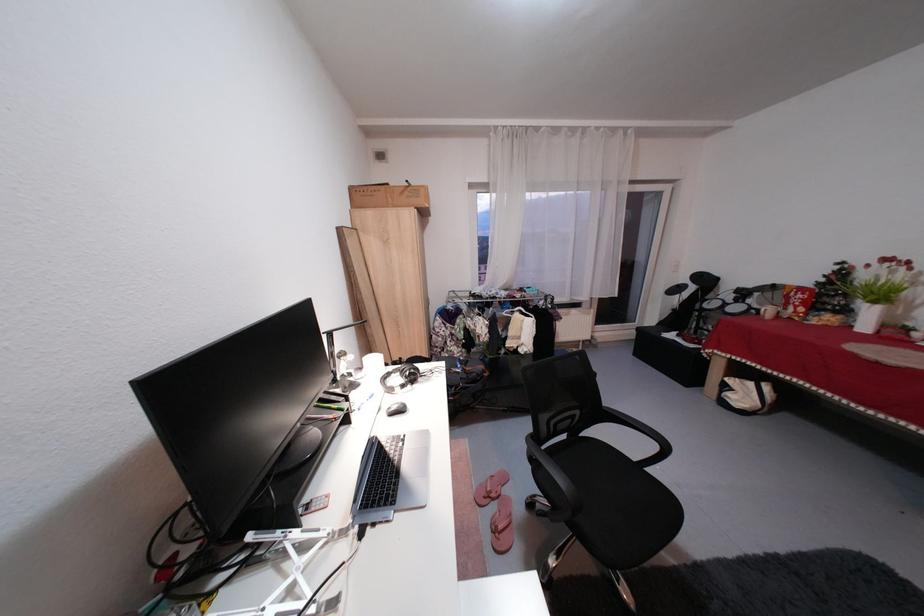
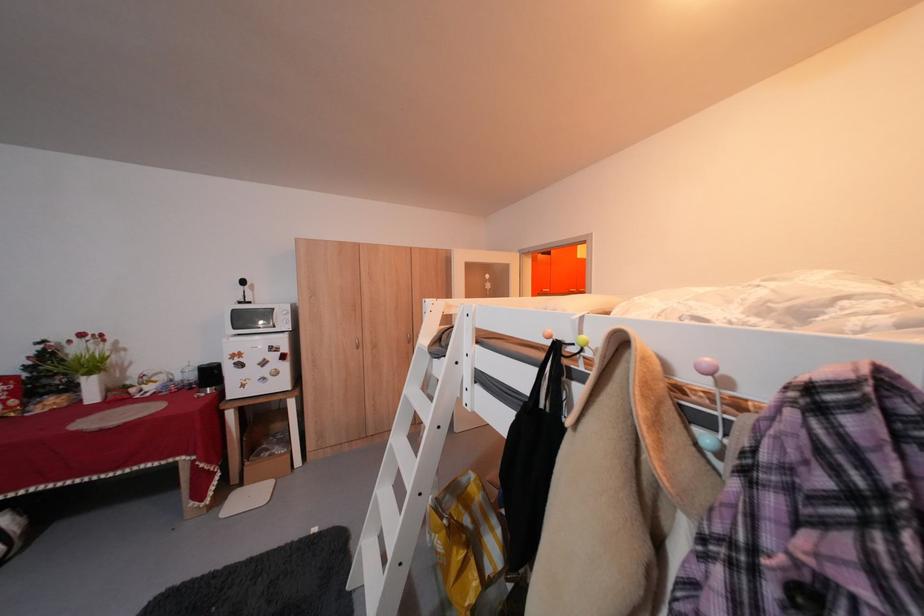
Question: The first image is from the beginning of the video and the second image is from the end. How did the camera likely rotate when shooting the video?

Choices:
 (A) Left
 (B) Right
 (C) Up
 (D) Down

Answer: (B)